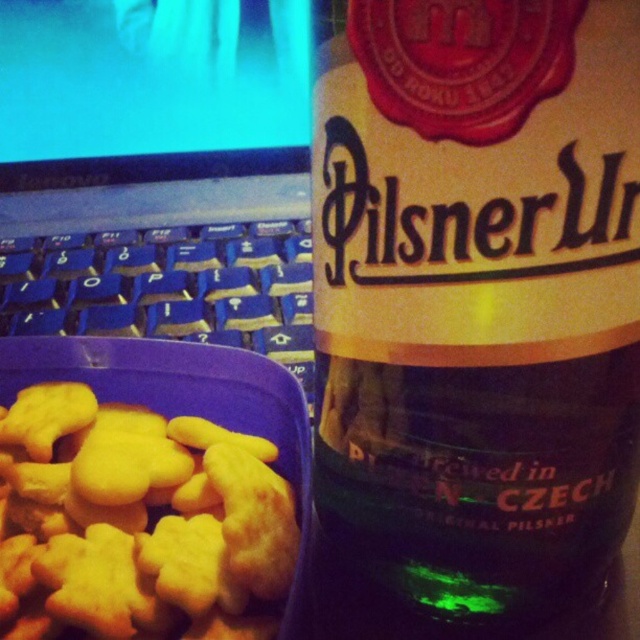
You are taking a photo of the scene and want to focus on the Pilsner Urquell bottle. Which of the two points, point (81, 454) or point (230, 230), should you focus on to ensure the bottle is sharp?

You should focus on point (81, 454) because it is closer to the camera and thus part of the Pilsner Urquell bottle that needs to be in focus.